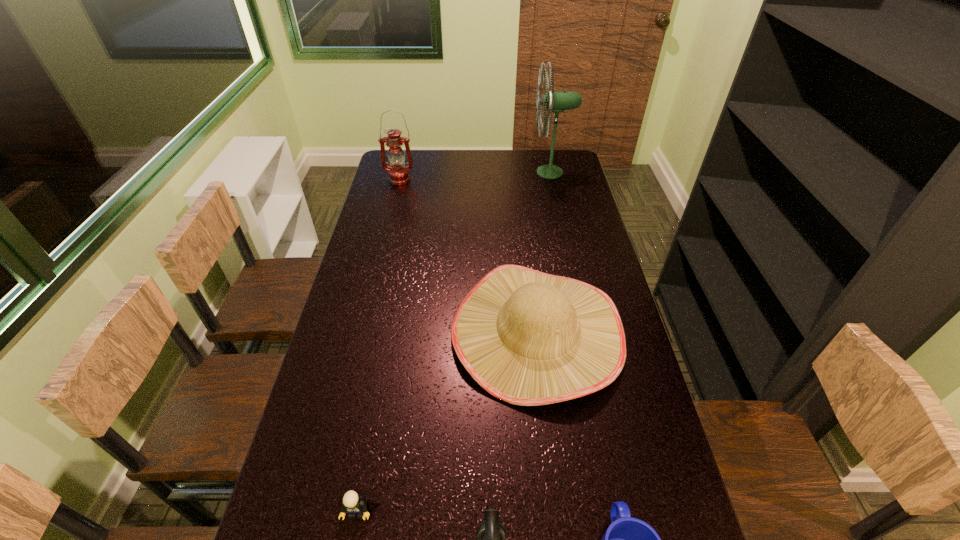
The image size is (960, 540). Find the location of `oil lamp positioned at the far edge`. oil lamp positioned at the far edge is located at coordinates (x=398, y=174).

Locate an element on the screen. The width and height of the screenshot is (960, 540). oil lamp at the left edge is located at coordinates (398, 174).

Locate an element on the screen. The width and height of the screenshot is (960, 540). Lego positioned at the left edge is located at coordinates (352, 504).

In order to click on fan located at the right edge in this screenshot , I will do `click(556, 102)`.

Where is `sunhat that is positioned at the right edge`? The height and width of the screenshot is (540, 960). sunhat that is positioned at the right edge is located at coordinates (529, 338).

Locate an element on the screen. object that is at the far left corner is located at coordinates (398, 174).

At what (x,y) coordinates should I click in order to perform the action: click on object that is at the far right corner. Please return your answer as a coordinate pair (x, y). Looking at the image, I should click on (556, 102).

This screenshot has height=540, width=960. I want to click on free space at the far edge, so click(x=466, y=165).

Identify the location of free space at the left edge. (387, 334).

At what (x,y) coordinates should I click in order to perform the action: click on free space at the right edge of the desktop. Please return your answer as a coordinate pair (x, y). Looking at the image, I should click on (594, 399).